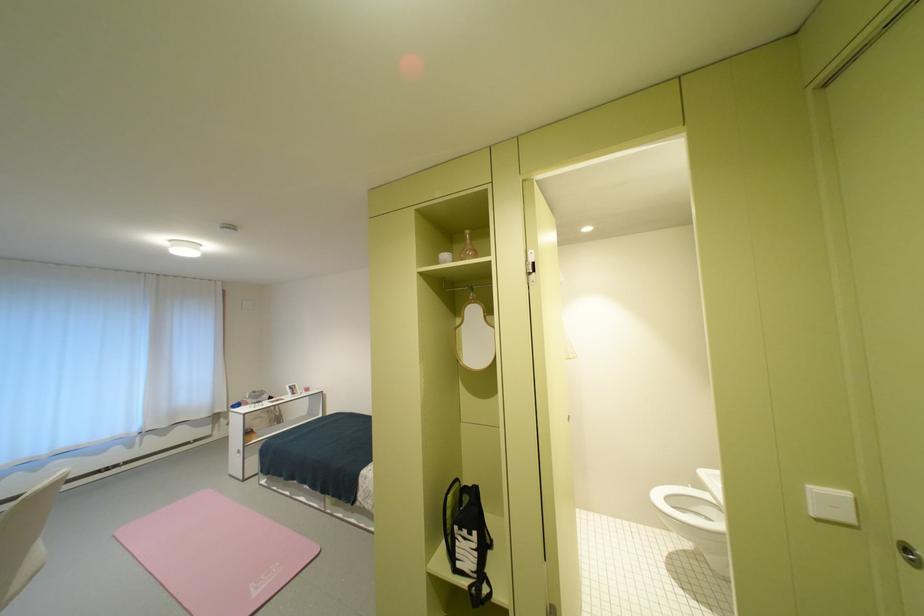
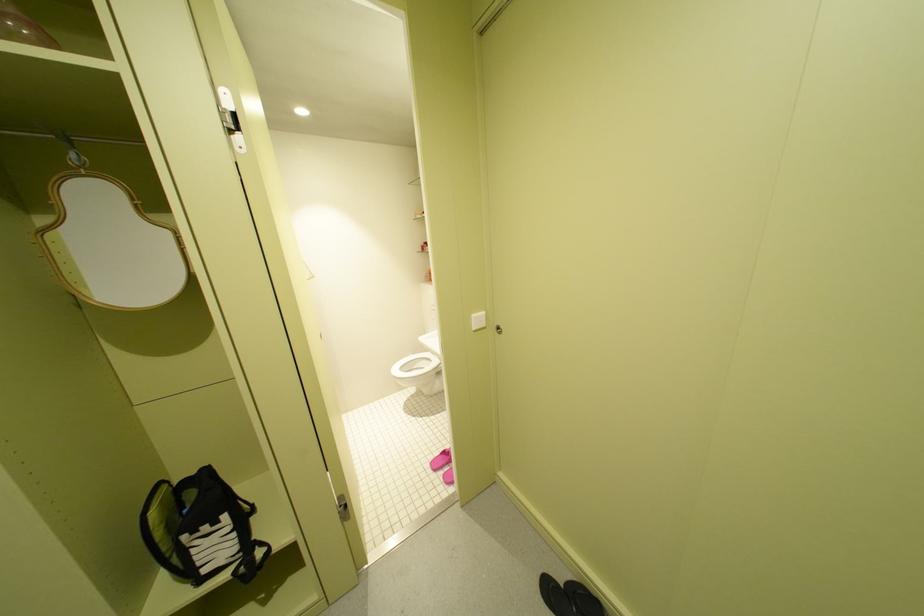
The first image is from the beginning of the video and the second image is from the end. How did the camera likely rotate when shooting the video?

The rotation direction of the camera is right-down.